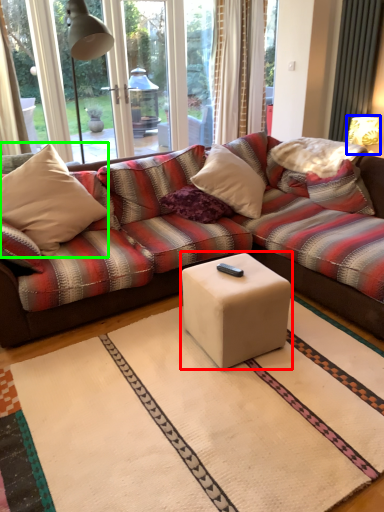
Question: Estimate the real-world distances between objects in this image. Which object is closer to coffee table (highlighted by a red box), table lamp (highlighted by a blue box) or throw pillow (highlighted by a green box)?

Choices:
 (A) table lamp
 (B) throw pillow

Answer: (B)